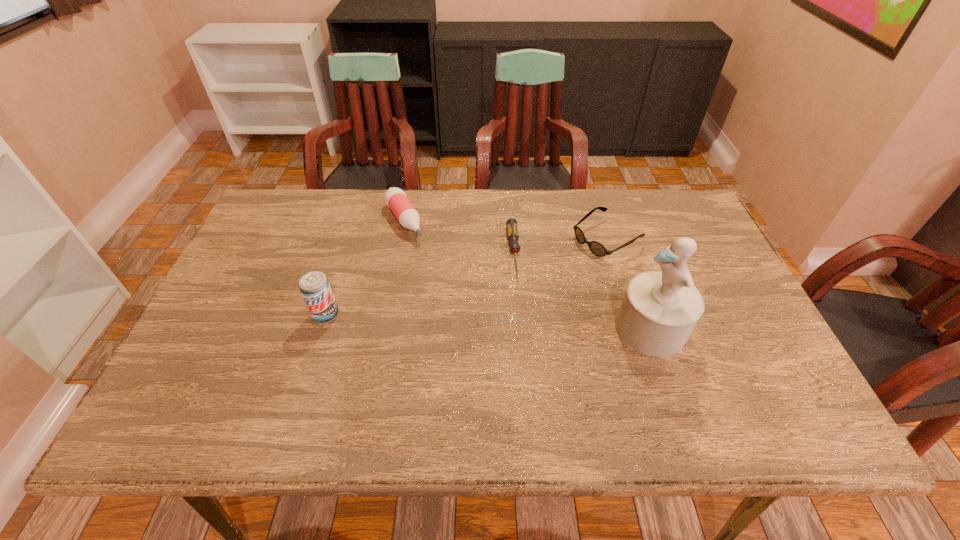
Identify the location of vacant region located with the cap open on the bottle. The image size is (960, 540). (463, 318).

I want to click on sunglasses that is positioned at the far edge, so click(596, 248).

You are a GUI agent. You are given a task and a screenshot of the screen. Output one action in this format:
    pyautogui.click(x=<x>, y=<y>)
    Task: Click on the screwdriver that is positioned at the far edge
    The width and height of the screenshot is (960, 540).
    Given the screenshot: What is the action you would take?
    pyautogui.click(x=512, y=228)

At what (x,y) coordinates should I click in order to perform the action: click on bottle present at the far edge. Please return your answer as a coordinate pair (x, y). Looking at the image, I should click on (395, 198).

At what (x,y) coordinates should I click in order to perform the action: click on free space at the far edge of the desktop. Please return your answer as a coordinate pair (x, y). Looking at the image, I should click on (523, 204).

Identify the location of vacant space at the near edge. (515, 386).

Locate an element on the screen. This screenshot has width=960, height=540. blank space at the left edge is located at coordinates (253, 265).

The image size is (960, 540). I want to click on blank space at the right edge of the desktop, so click(x=717, y=291).

The image size is (960, 540). I want to click on free spot at the far left corner of the desktop, so [257, 227].

In the image, there is a desktop. Where is `vacant space at the far right corner`? The image size is (960, 540). vacant space at the far right corner is located at coordinates (683, 197).